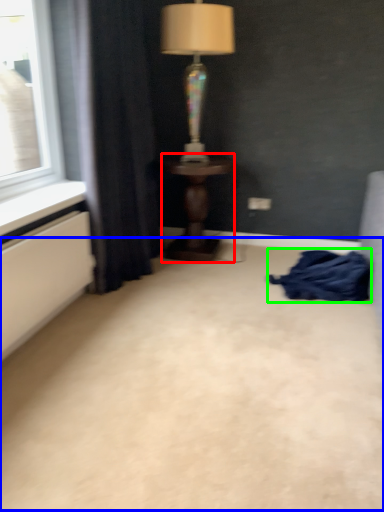
Question: Which object is the closest to the table (highlighted by a red box)? Choose among these: plain (highlighted by a blue box) or blanket (highlighted by a green box).

Choices:
 (A) plain
 (B) blanket

Answer: (B)